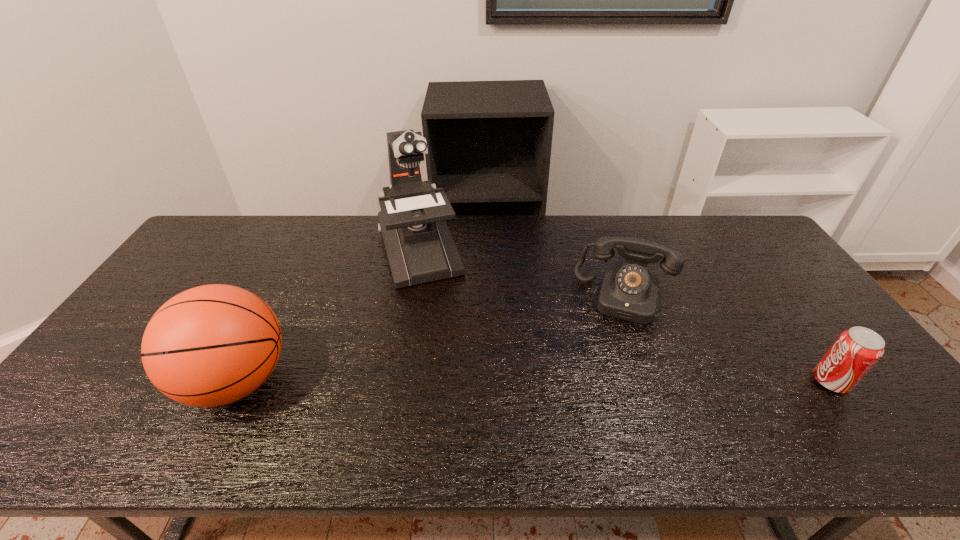
Identify the location of free spot located through the eyepieces of the tallest object. Image resolution: width=960 pixels, height=540 pixels. click(462, 383).

Find the location of a particular element. vacant point located 0.270m through the eyepieces of the tallest object is located at coordinates (451, 353).

Image resolution: width=960 pixels, height=540 pixels. I want to click on vacant point located through the eyepieces of the tallest object, so click(439, 317).

Identify the location of vacant space situated on the dial of the telephone. The width and height of the screenshot is (960, 540). (608, 372).

The image size is (960, 540). I want to click on free space located 0.110m on the dial of the telephone, so click(612, 352).

Where is `free space located 0.240m on the dial of the telephone`? The width and height of the screenshot is (960, 540). free space located 0.240m on the dial of the telephone is located at coordinates (604, 391).

You are a GUI agent. You are given a task and a screenshot of the screen. Output one action in this format:
    pyautogui.click(x=<x>, y=<y>)
    Task: Click on the object positioned at the far edge
    This screenshot has width=960, height=540.
    Given the screenshot: What is the action you would take?
    pyautogui.click(x=419, y=246)

Where is `basketball situated at the near edge`? Image resolution: width=960 pixels, height=540 pixels. basketball situated at the near edge is located at coordinates (211, 345).

This screenshot has width=960, height=540. Find the location of `soda can at the near edge`. soda can at the near edge is located at coordinates (856, 350).

Where is `object located at the right edge`? object located at the right edge is located at coordinates (856, 350).